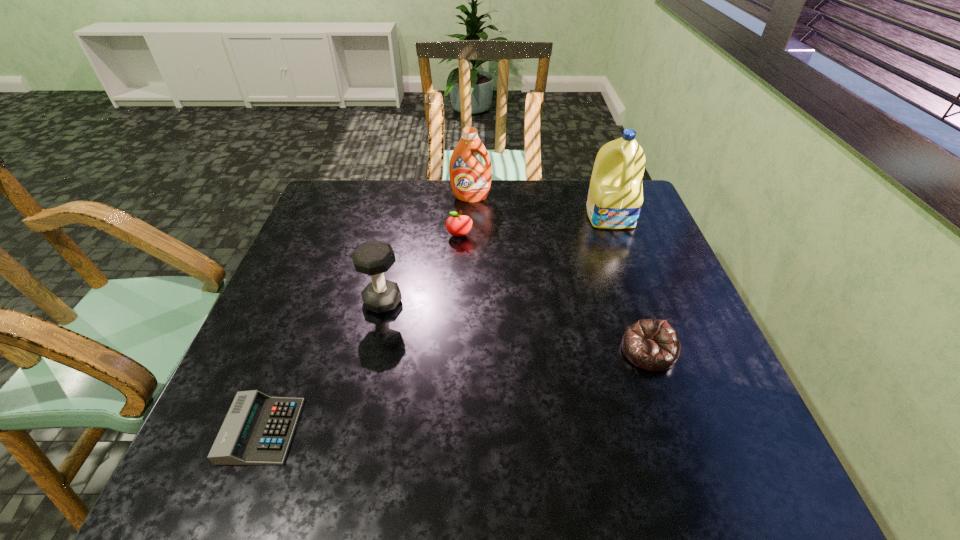
Find the location of a particular element. vacant space that's between the beanbag and the nearer detergent is located at coordinates (630, 284).

This screenshot has height=540, width=960. I want to click on vacant area that lies between the fifth farthest object and the farther detergent, so click(560, 274).

At what (x,y) coordinates should I click in order to perform the action: click on empty space between the dumbbell and the apple. Please return your answer as a coordinate pair (x, y). Image resolution: width=960 pixels, height=540 pixels. Looking at the image, I should click on (421, 268).

Locate an element on the screen. free space between the fifth farthest object and the fifth nearest object is located at coordinates (630, 284).

You are a GUI agent. You are given a task and a screenshot of the screen. Output one action in this format:
    pyautogui.click(x=<x>, y=<y>)
    Task: Click on the free space between the calculator and the fourth shortest object
    
    Given the screenshot: What is the action you would take?
    pyautogui.click(x=323, y=366)

Find the location of a particular element. free space between the second shortest object and the third tallest object is located at coordinates (516, 326).

This screenshot has height=540, width=960. I want to click on empty space that is in between the fifth nearest object and the second shortest object, so click(630, 284).

You are a GUI agent. You are given a task and a screenshot of the screen. Output one action in this format:
    pyautogui.click(x=<x>, y=<y>)
    Task: Click on the vacant space in between the beanbag and the third shortest object
    Image resolution: width=960 pixels, height=540 pixels.
    Given the screenshot: What is the action you would take?
    (554, 294)

I want to click on object that is the fifth closest to the second shortest object, so click(x=258, y=429).

The height and width of the screenshot is (540, 960). Identify the location of object that stands as the fourth closest to the third shortest object. [x=652, y=344].